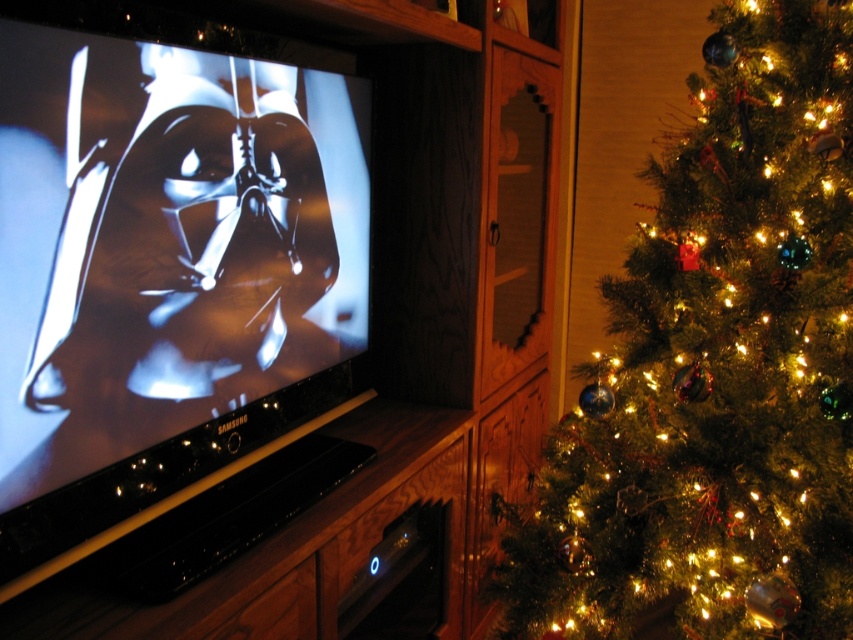
Question: Which of the following is the closest to the observer?

Choices:
 (A) (215, 296)
 (B) (773, 604)

Answer: (A)

Question: Can you confirm if black glossy entertainment center at center is wider than green matte christmas tree at right?

Choices:
 (A) no
 (B) yes

Answer: (B)

Question: Which object appears farthest from the camera in this image?

Choices:
 (A) green matte christmas tree at right
 (B) black glossy entertainment center at center

Answer: (A)

Question: Does black glossy entertainment center at center have a greater width compared to green matte christmas tree at right?

Choices:
 (A) no
 (B) yes

Answer: (B)

Question: Which point appears farthest from the camera in this image?

Choices:
 (A) (706, 349)
 (B) (68, 250)

Answer: (A)

Question: Is black glossy entertainment center at center above green matte christmas tree at right?

Choices:
 (A) yes
 (B) no

Answer: (B)